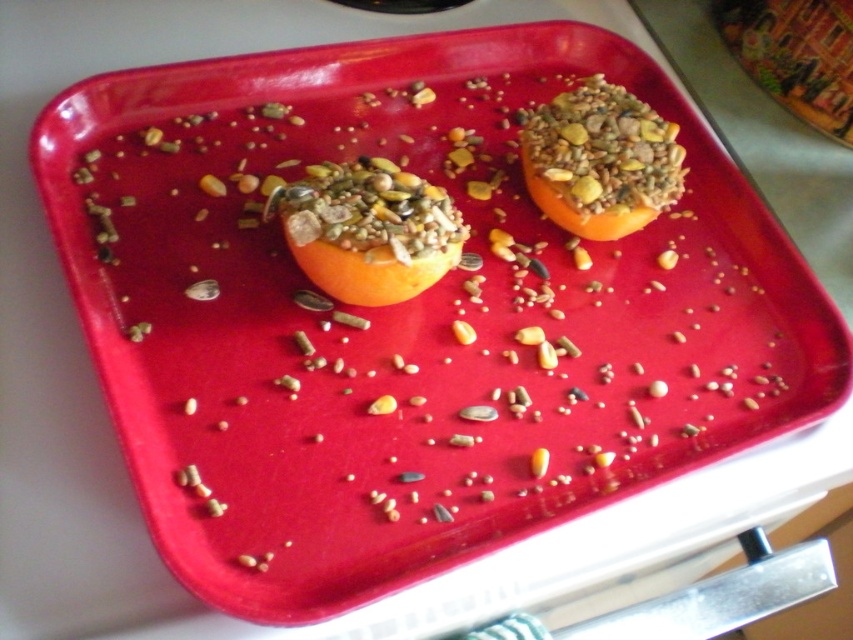
Which of these two, orange matte at center or orange textured fruit at upper right, stands taller?

Standing taller between the two is orange textured fruit at upper right.

Is orange matte at center behind orange textured fruit at upper right?

No, orange matte at center is closer to the viewer.

Is point (407, 292) positioned behind point (527, 141)?

That is False.

Identify the location of orange matte at center. (369, 230).